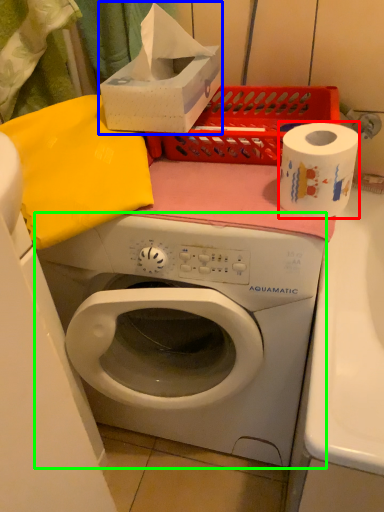
Question: Considering the real-world distances, which object is closest to paper towel (highlighted by a red box)? box (highlighted by a blue box) or washing machine (highlighted by a green box).

Choices:
 (A) box
 (B) washing machine

Answer: (A)